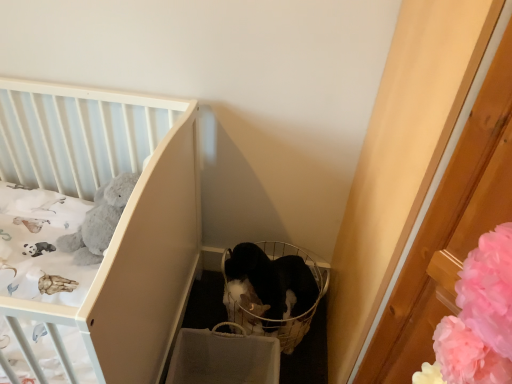
Question: From a real-world perspective, is black fabric basket at center above or below white matte crib at upper left?

Choices:
 (A) above
 (B) below

Answer: (B)

Question: In the image, is black fabric basket at center on the left side or the right side of white matte crib at upper left?

Choices:
 (A) left
 (B) right

Answer: (B)

Question: Which object is the farthest from the black fabric basket at center?

Choices:
 (A) white matte crib at upper left
 (B) black fur cat at center

Answer: (A)

Question: Based on their relative distances, which object is farther from the black fabric basket at center?

Choices:
 (A) black fur cat at center
 (B) white matte crib at upper left

Answer: (B)